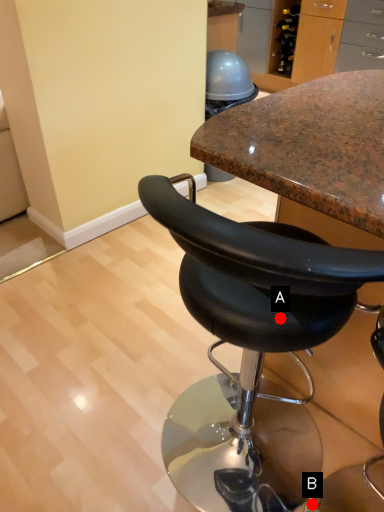
Question: Two points are circled on the image, labeled by A and B beside each circle. Among these points, which one is farthest from the camera?

Choices:
 (A) A is further
 (B) B is further

Answer: (B)